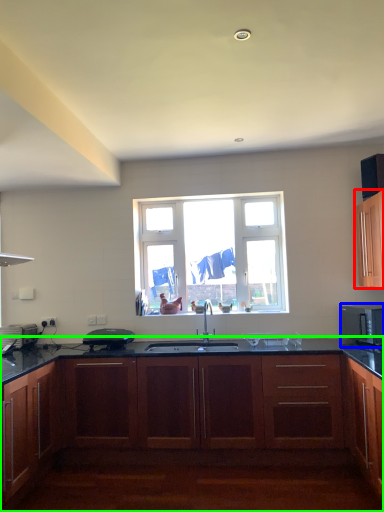
Question: Based on their relative distances, which object is nearer to cabinetry (highlighted by a red box)? Choose from microwave oven (highlighted by a blue box) and cabinetry (highlighted by a green box).

Choices:
 (A) microwave oven
 (B) cabinetry

Answer: (A)